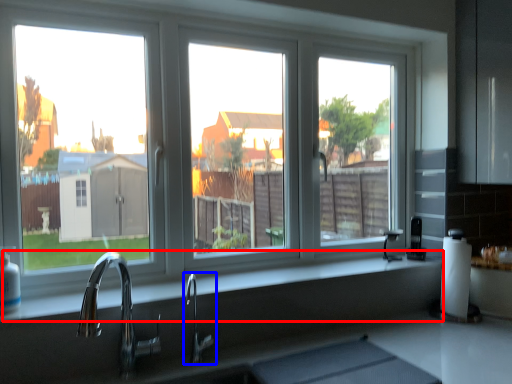
Question: Among these objects, which one is farthest to the camera, counter top (highlighted by a red box) or tap (highlighted by a blue box)?

Choices:
 (A) counter top
 (B) tap

Answer: (B)